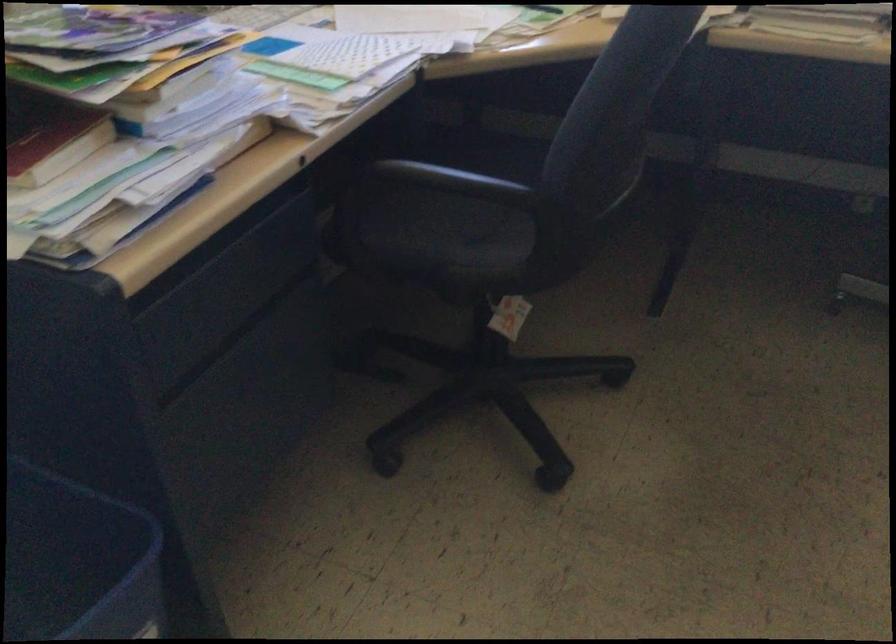
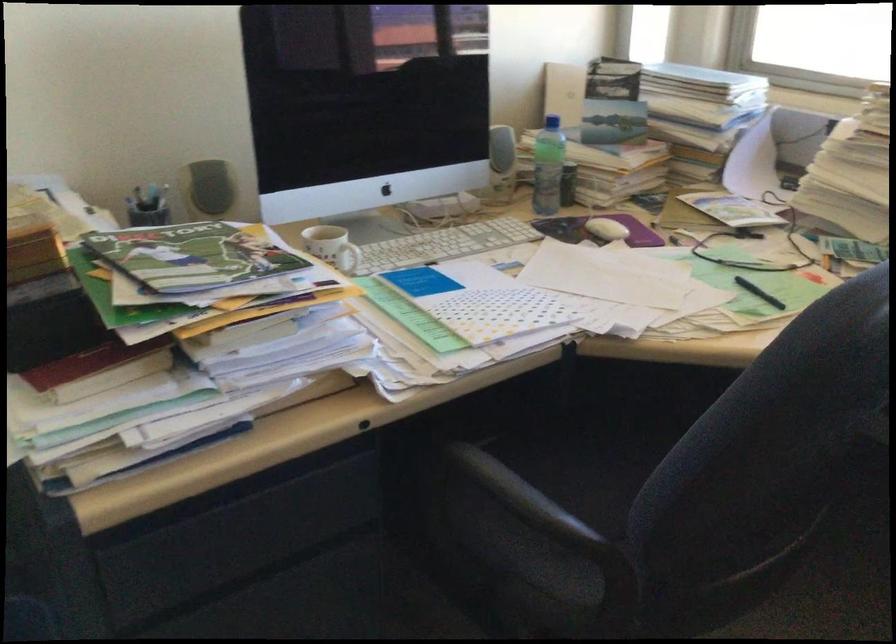
Locate, in the second image, the point that corresponds to the point at 474,178 in the first image.

(532, 506)